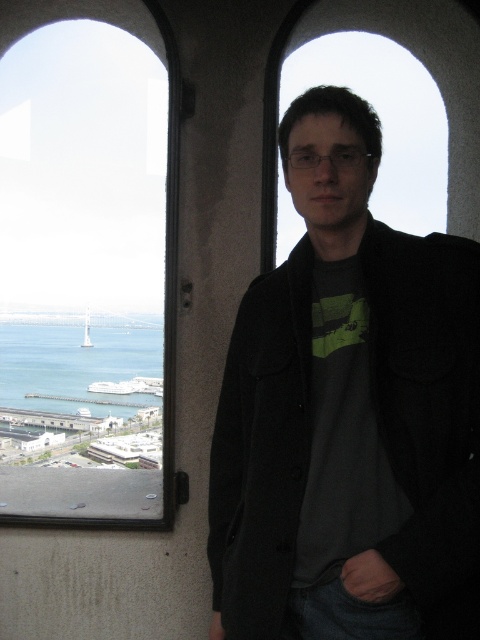
Consider the image. Between black woolen jacket at center and blue water at lower left, which one appears on the left side from the viewer's perspective?

blue water at lower left is more to the left.

Who is higher up, black woolen jacket at center or blue water at lower left?

Positioned higher is black woolen jacket at center.

Is point (434, 472) farther from viewer compared to point (136, 348)?

No, (434, 472) is closer to viewer.

This screenshot has height=640, width=480. What are the coordinates of `black woolen jacket at center` in the screenshot? It's located at (429, 413).

Is point (32, 316) positioned before point (97, 413)?

No, it is not.

Based on the photo, which is more to the left, transparent glass window at upper left or blue water at lower left?

Positioned to the left is blue water at lower left.

Describe the element at coordinates (88, 268) in the screenshot. The width and height of the screenshot is (480, 640). I see `transparent glass window at upper left` at that location.

Image resolution: width=480 pixels, height=640 pixels. Find the location of `transparent glass window at upper left`. transparent glass window at upper left is located at coordinates (x=88, y=268).

Is transparent glass window at upper left bigger than black woolen jacket at center?

Yes, transparent glass window at upper left is bigger than black woolen jacket at center.

Between point (76, 113) and point (376, 378), which one is positioned in front?

Point (376, 378) is more forward.

Locate an element on the screen. transparent glass window at upper left is located at coordinates (88, 268).